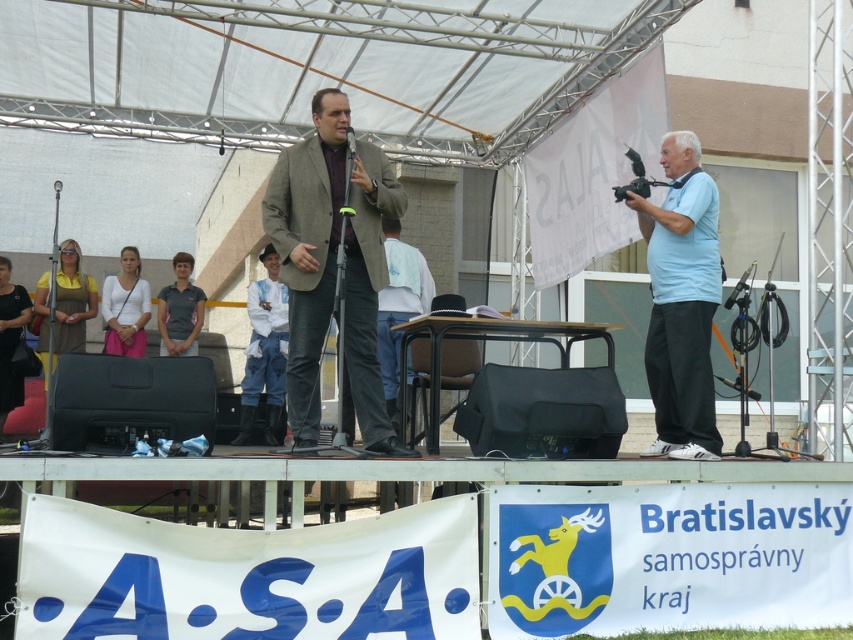
Question: Can you confirm if matte brown suit at center is positioned to the right of white fabric shirt at center?

Choices:
 (A) yes
 (B) no

Answer: (A)

Question: From the image, what is the correct spatial relationship of matte brown suit at center in relation to yellow fabric dress at left?

Choices:
 (A) above
 (B) below

Answer: (A)

Question: Does white fabric shirt at center appear on the left side of dark blue jersey at center?

Choices:
 (A) no
 (B) yes

Answer: (B)

Question: Which object appears closest to the camera in this image?

Choices:
 (A) metallic silver microphone at center
 (B) dark blue jersey at center

Answer: (A)

Question: Which of the following is the farthest from the observer?

Choices:
 (A) (373, 248)
 (B) (61, 337)

Answer: (B)

Question: Among these objects, which one is farthest from the camera?

Choices:
 (A) dark blue jersey at center
 (B) yellow fabric dress at left

Answer: (A)